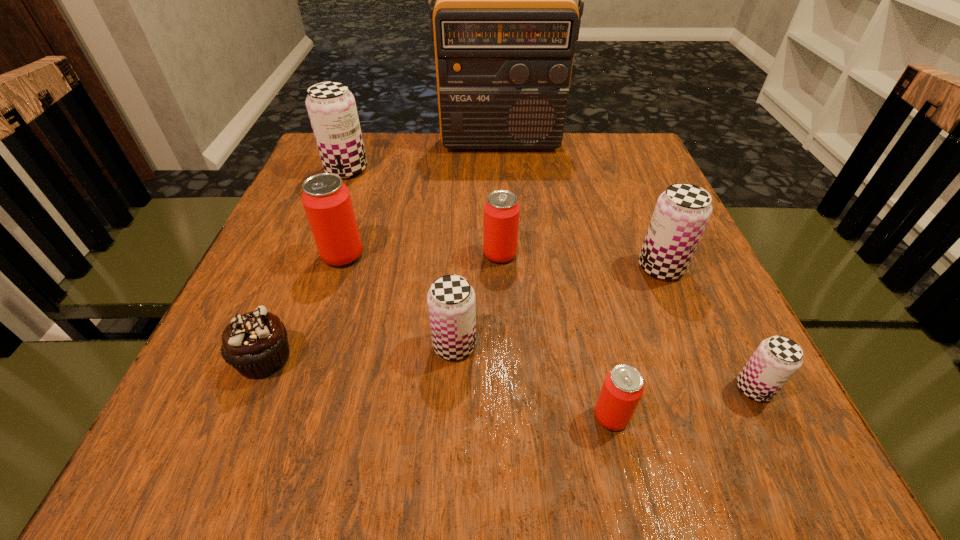
This screenshot has width=960, height=540. Identify the location of radio receiver. (504, 26).

Where is `the tallest object`? the tallest object is located at coordinates (504, 26).

Locate an element on the screen. the second tallest object is located at coordinates (331, 107).

Where is `the biggest purple beer can`? Image resolution: width=960 pixels, height=540 pixels. the biggest purple beer can is located at coordinates (331, 107).

This screenshot has height=540, width=960. Identify the location of the biggest red beer can. (326, 199).

Where is `the third nearest purple beer can`? This screenshot has width=960, height=540. the third nearest purple beer can is located at coordinates (681, 214).

The width and height of the screenshot is (960, 540). I want to click on the fourth beer can from left to right, so click(501, 211).

The image size is (960, 540). I want to click on the second biggest red beer can, so click(x=501, y=211).

Locate an element on the screen. The width and height of the screenshot is (960, 540). the third biggest purple beer can is located at coordinates (451, 301).

Find the location of a particular element. This screenshot has width=960, height=540. the fifth beer can from right to left is located at coordinates (451, 301).